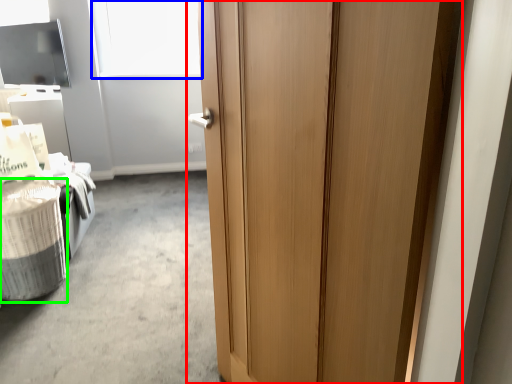
Question: Which object is the farthest from door (highlighted by a red box)? Choose among these: window screen (highlighted by a blue box) or laundry basket (highlighted by a green box).

Choices:
 (A) window screen
 (B) laundry basket

Answer: (A)